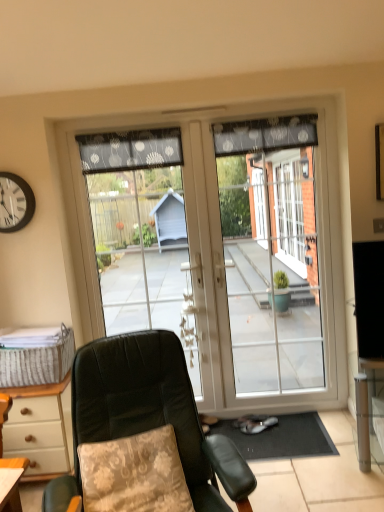
Locate an element on the screen. vacant region above black sheer curtain at upper center, which is the 2th curtain in left-to-right order (from a real-world perspective) is located at coordinates (255, 113).